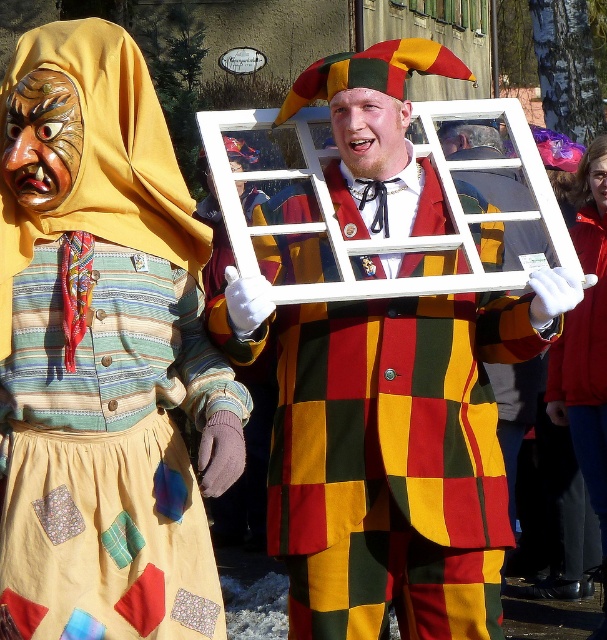
From the picture: You are an artist trying to sketch the scene. You notice the matte yellow hood at upper left and the matte wooden window frame at center. Which object should you draw first if you want to follow the top to bottom approach?

The matte yellow hood at upper left should be drawn first because it is located above the matte wooden window frame at center.

You are an observer standing in front of the scene. You notice the matte yellow hood at upper left and the matte wooden window frame at center. Which object is positioned more to the left side of the scene?

The matte yellow hood at upper left is positioned more to the left side of the scene than the matte wooden window frame at center.

You are an artist trying to sketch the scene. You notice the matte yellow hood at upper left and the matte wooden window frame at center. Which object should you draw first if you want to start with the taller one?

The matte yellow hood at upper left is much taller than the matte wooden window frame at center, so you should draw the matte yellow hood at upper left first.